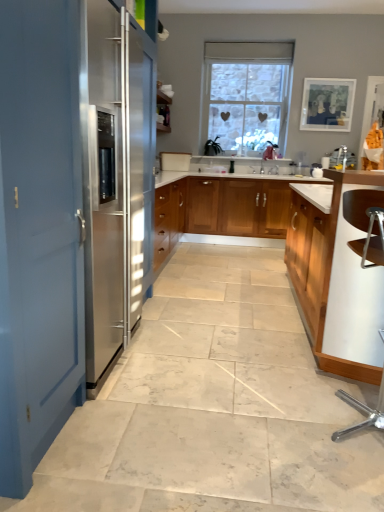
What do you see at coordinates (237, 207) in the screenshot?
I see `wooden cabinet at center, which is counted as the second cabinetry, starting from the front` at bounding box center [237, 207].

Where is `stone textured window at center`? stone textured window at center is located at coordinates (247, 92).

In order to click on light wood/wooden cabinet at right, which ranks as the 1th cabinetry in front-to-back order in this screenshot , I will do `click(335, 281)`.

Describe the element at coordinates (335, 281) in the screenshot. I see `light wood/wooden cabinet at right, which ranks as the 1th cabinetry in front-to-back order` at that location.

Measure the distance between blue matte door at left and camera.

blue matte door at left and camera are 1.11 meters apart from each other.

Where is `wooden cabinet at center, positioned as the first cabinetry in back-to-front order`? This screenshot has height=512, width=384. wooden cabinet at center, positioned as the first cabinetry in back-to-front order is located at coordinates (237, 207).

Is point (254, 48) less distant than point (225, 194)?

No, (254, 48) is further to viewer.

In the scene shown: Measure the distance between stone textured window at center and wooden cabinet at center, positioned as the first cabinetry in back-to-front order.

stone textured window at center and wooden cabinet at center, positioned as the first cabinetry in back-to-front order, are 1.68 meters apart from each other.

Is stone textured window at center next to wooden cabinet at center, positioned as the first cabinetry in back-to-front order?

No, stone textured window at center is not with wooden cabinet at center, positioned as the first cabinetry in back-to-front order.

Is wooden cabinet at center, which is counted as the second cabinetry, starting from the front, not close to stone textured window at center?

Yes, wooden cabinet at center, which is counted as the second cabinetry, starting from the front, is far from stone textured window at center.

Considering the positions of points (259, 204) and (233, 44), is point (259, 204) farther from camera compared to point (233, 44)?

No, (259, 204) is in front of (233, 44).

From a real-world perspective, is wooden cabinet at center, positioned as the first cabinetry in back-to-front order, physically below stone textured window at center?

Yes, from a real-world perspective, wooden cabinet at center, positioned as the first cabinetry in back-to-front order, is beneath stone textured window at center.

At what (x,y) coordinates should I click in order to perform the action: click on door that is in front of the light wood/wooden cabinet at right, arranged as the second cabinetry when viewed from the back. Please return your answer as a coordinate pair (x, y). Looking at the image, I should click on point(40,230).

Which of these two, blue matte door at left or light wood/wooden cabinet at right, arranged as the second cabinetry when viewed from the back, is wider?

light wood/wooden cabinet at right, arranged as the second cabinetry when viewed from the back.

Considering the positions of objects blue matte door at left and light wood/wooden cabinet at right, arranged as the second cabinetry when viewed from the back, in the image provided, who is behind, blue matte door at left or light wood/wooden cabinet at right, arranged as the second cabinetry when viewed from the back,?

Positioned behind is light wood/wooden cabinet at right, arranged as the second cabinetry when viewed from the back.

Is blue matte door at left facing away from light wood/wooden cabinet at right, which ranks as the 1th cabinetry in front-to-back order?

No, blue matte door at left's orientation is not away from light wood/wooden cabinet at right, which ranks as the 1th cabinetry in front-to-back order.

From a real-world perspective, which object rests below the other?

blue matte door at left.

Considering the sizes of objects stone textured window at center and blue matte door at left in the image provided, who is smaller, stone textured window at center or blue matte door at left?

stone textured window at center is smaller.

From the image's perspective, is stone textured window at center on blue matte door at left?

Correct, stone textured window at center appears higher than blue matte door at left in the image.

Does stone textured window at center have a lesser width compared to light wood/wooden cabinet at right, which ranks as the 1th cabinetry in front-to-back order?

Correct, the width of stone textured window at center is less than that of light wood/wooden cabinet at right, which ranks as the 1th cabinetry in front-to-back order.

Considering the relative sizes of stone textured window at center and light wood/wooden cabinet at right, arranged as the second cabinetry when viewed from the back, in the image provided, is stone textured window at center smaller than light wood/wooden cabinet at right, arranged as the second cabinetry when viewed from the back,?

Yes, stone textured window at center is smaller than light wood/wooden cabinet at right, arranged as the second cabinetry when viewed from the back.

Between stone textured window at center and light wood/wooden cabinet at right, which ranks as the 1th cabinetry in front-to-back order, which one has more height?

With more height is stone textured window at center.

How different are the orientations of light wood/wooden cabinet at right, arranged as the second cabinetry when viewed from the back, and wooden cabinet at center, positioned as the first cabinetry in back-to-front order, in degrees?

The angle between the facing direction of light wood/wooden cabinet at right, arranged as the second cabinetry when viewed from the back, and the facing direction of wooden cabinet at center, positioned as the first cabinetry in back-to-front order, is 180 degrees.

From a real-world perspective, between light wood/wooden cabinet at right, arranged as the second cabinetry when viewed from the back, and wooden cabinet at center, positioned as the first cabinetry in back-to-front order, who is vertically lower?

wooden cabinet at center, positioned as the first cabinetry in back-to-front order.

Between light wood/wooden cabinet at right, which ranks as the 1th cabinetry in front-to-back order, and wooden cabinet at center, which is counted as the second cabinetry, starting from the front, which one appears on the left side from the viewer's perspective?

From the viewer's perspective, wooden cabinet at center, which is counted as the second cabinetry, starting from the front, appears more on the left side.

Does light wood/wooden cabinet at right, arranged as the second cabinetry when viewed from the back, have a lesser width compared to wooden cabinet at center, positioned as the first cabinetry in back-to-front order?

No.

Between blue matte door at left and stone textured window at center, which one appears on the right side from the viewer's perspective?

Positioned to the right is stone textured window at center.

Is blue matte door at left in contact with stone textured window at center?

No, blue matte door at left is not beside stone textured window at center.

Based on the photo, which point is more forward, (2, 416) or (282, 100)?

Positioned in front is point (2, 416).

Is blue matte door at left outside of stone textured window at center?

blue matte door at left lies outside stone textured window at center's area.

From a real-world perspective, starting from the stone textured window at center, which cabinetry is the 2nd one below it? Please provide its 2D coordinates.

[(237, 207)]

You are a GUI agent. You are given a task and a screenshot of the screen. Output one action in this format:
    pyautogui.click(x=<x>, y=<y>)
    Task: Click on the window that is above the wooden cabinet at center, positioned as the first cabinetry in back-to-front order (from the image's perspective)
    Image resolution: width=384 pixels, height=512 pixels.
    Given the screenshot: What is the action you would take?
    pyautogui.click(x=247, y=92)

Which object lies further to the anchor point wooden cabinet at center, which is counted as the second cabinetry, starting from the front, light wood/wooden cabinet at right, which ranks as the 1th cabinetry in front-to-back order, or blue matte door at left?

blue matte door at left is further to wooden cabinet at center, which is counted as the second cabinetry, starting from the front.

Which object lies nearer to the anchor point light wood/wooden cabinet at right, arranged as the second cabinetry when viewed from the back, stone textured window at center or wooden cabinet at center, which is counted as the second cabinetry, starting from the front?

wooden cabinet at center, which is counted as the second cabinetry, starting from the front, is closer to light wood/wooden cabinet at right, arranged as the second cabinetry when viewed from the back.

Estimate the real-world distances between objects in this image. Which object is closer to light wood/wooden cabinet at right, arranged as the second cabinetry when viewed from the back, stone textured window at center or blue matte door at left?

blue matte door at left.

Looking at the image, which one is located further to stone textured window at center, blue matte door at left or light wood/wooden cabinet at right, which ranks as the 1th cabinetry in front-to-back order?

Among the two, blue matte door at left is located further to stone textured window at center.

Based on the photo, which object lies nearer to the anchor point wooden cabinet at center, which is counted as the second cabinetry, starting from the front, stone textured window at center or blue matte door at left?

Based on the image, stone textured window at center appears to be nearer to wooden cabinet at center, which is counted as the second cabinetry, starting from the front.

When comparing their distances from wooden cabinet at center, positioned as the first cabinetry in back-to-front order, does light wood/wooden cabinet at right, which ranks as the 1th cabinetry in front-to-back order, or stone textured window at center seem further?

stone textured window at center.

Considering their positions, is light wood/wooden cabinet at right, which ranks as the 1th cabinetry in front-to-back order, positioned further to stone textured window at center than blue matte door at left?

Based on the image, blue matte door at left appears to be further to stone textured window at center.

Consider the image. From the image, which object appears to be nearer to light wood/wooden cabinet at right, arranged as the second cabinetry when viewed from the back, wooden cabinet at center, which is counted as the second cabinetry, starting from the front, or blue matte door at left?

blue matte door at left.

Identify the location of cabinetry between light wood/wooden cabinet at right, arranged as the second cabinetry when viewed from the back, and stone textured window at center, along the z-axis. (237, 207).

You are a GUI agent. You are given a task and a screenshot of the screen. Output one action in this format:
    pyautogui.click(x=<x>, y=<y>)
    Task: Click on the cabinetry located between blue matte door at left and wooden cabinet at center, which is counted as the second cabinetry, starting from the front, in the depth direction
    The width and height of the screenshot is (384, 512).
    Given the screenshot: What is the action you would take?
    pyautogui.click(x=335, y=281)